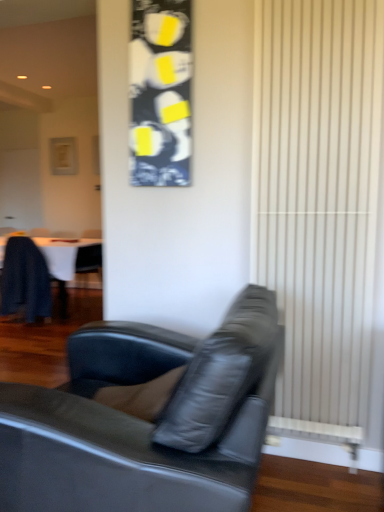
Question: In terms of width, does white textured radiator at right look wider or thinner when compared to dark wood table at left?

Choices:
 (A) thin
 (B) wide

Answer: (A)

Question: Is point (344, 403) positioned closer to the camera than point (61, 300)?

Choices:
 (A) farther
 (B) closer

Answer: (B)

Question: Considering the real-world distances, which object is closest to the white textured radiator at right?

Choices:
 (A) black leather couch at center
 (B) dark blue leather chair at left
 (C) dark wood table at left

Answer: (A)

Question: Which of these objects is positioned closest to the dark wood table at left?

Choices:
 (A) white textured radiator at right
 (B) dark blue leather chair at left
 (C) black leather couch at center

Answer: (B)